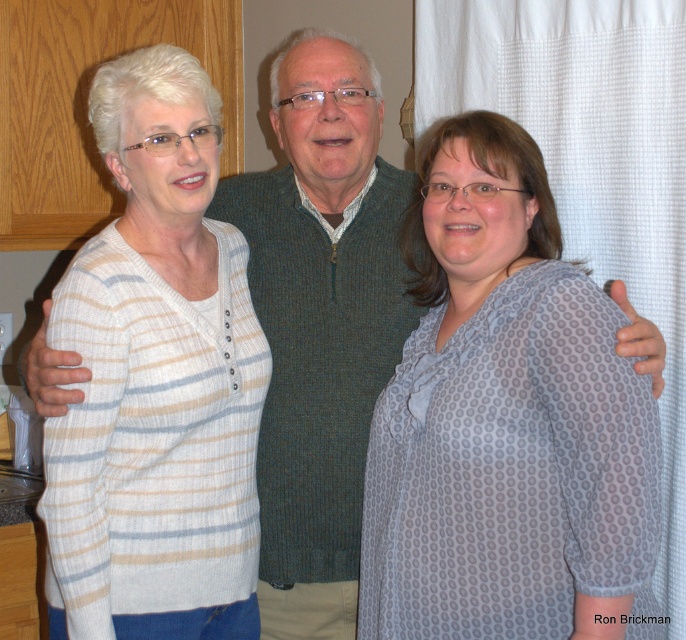
Question: Can you confirm if gray dotted blouse at center is thinner than white striped sweater at left?

Choices:
 (A) no
 (B) yes

Answer: (A)

Question: Which point is closer to the camera taking this photo?

Choices:
 (A) (141, 422)
 (B) (364, 616)

Answer: (A)

Question: Is gray dotted blouse at center in front of white striped sweater at left?

Choices:
 (A) yes
 (B) no

Answer: (A)

Question: Which point is farther from the camera taking this photo?

Choices:
 (A) (541, 180)
 (B) (158, 72)

Answer: (A)

Question: Is gray dotted blouse at center wider than white striped sweater at left?

Choices:
 (A) no
 (B) yes

Answer: (B)